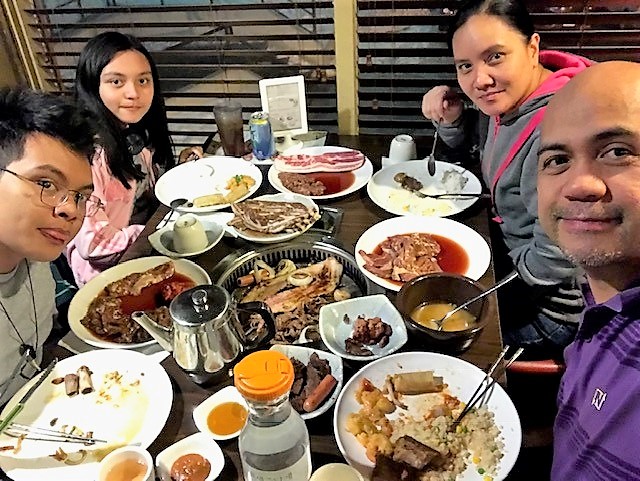
You are a GUI agent. You are given a task and a screenshot of the screen. Output one action in this format:
    pyautogui.click(x=<x>, y=<y>)
    Task: Click on the cup
    The image size is (640, 481).
    Given the screenshot: What is the action you would take?
    pyautogui.click(x=333, y=469), pyautogui.click(x=144, y=457), pyautogui.click(x=189, y=228), pyautogui.click(x=404, y=144), pyautogui.click(x=230, y=122)